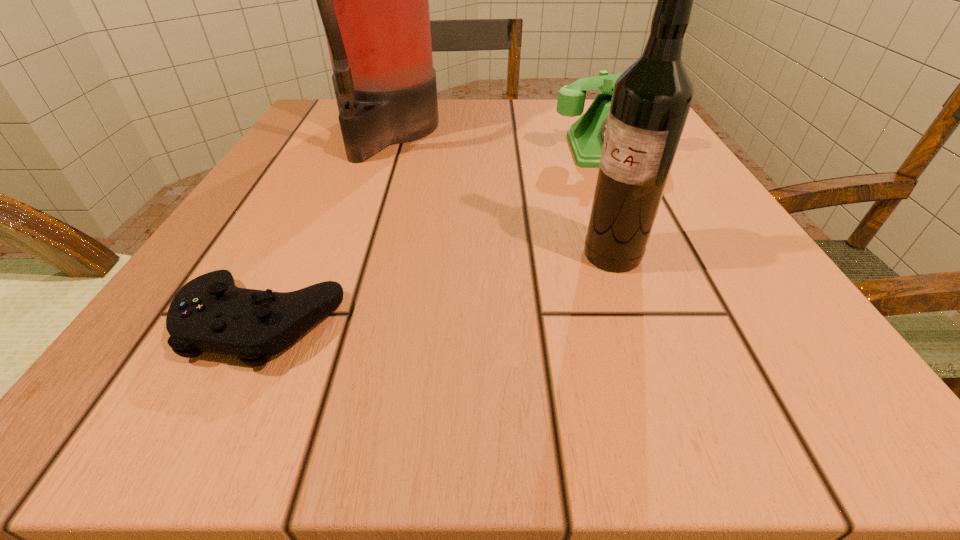
The height and width of the screenshot is (540, 960). What are the coordinates of `vacant point that satisfies the following two spatial constraints: 1. on the dial of the telephone; 2. on the front and back of the third shortest object` in the screenshot? It's located at (660, 255).

Find the location of `vacant position in the image that satisfies the following two spatial constraints: 1. on the dial of the telephone; 2. on the front and back of the second tallest object`. vacant position in the image that satisfies the following two spatial constraints: 1. on the dial of the telephone; 2. on the front and back of the second tallest object is located at coordinates (660, 255).